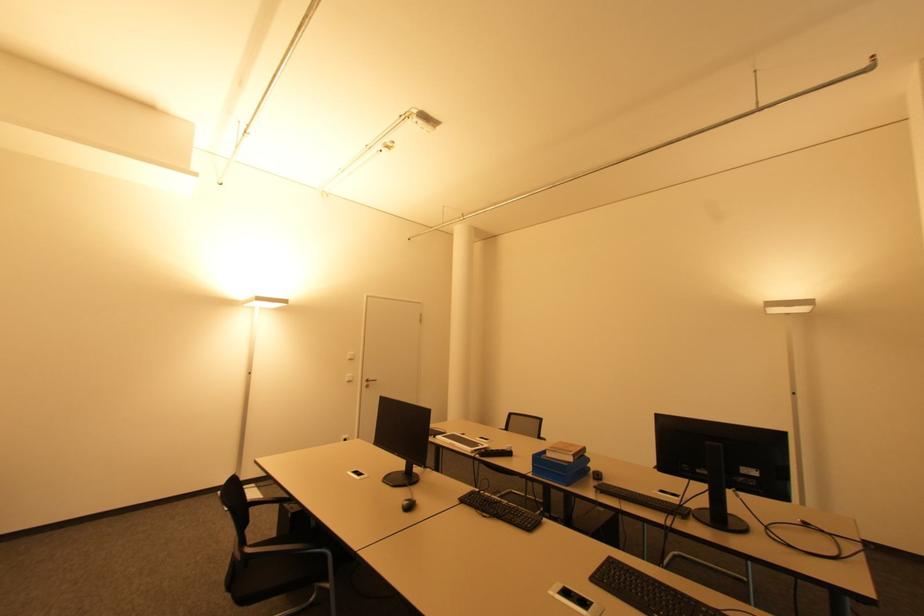
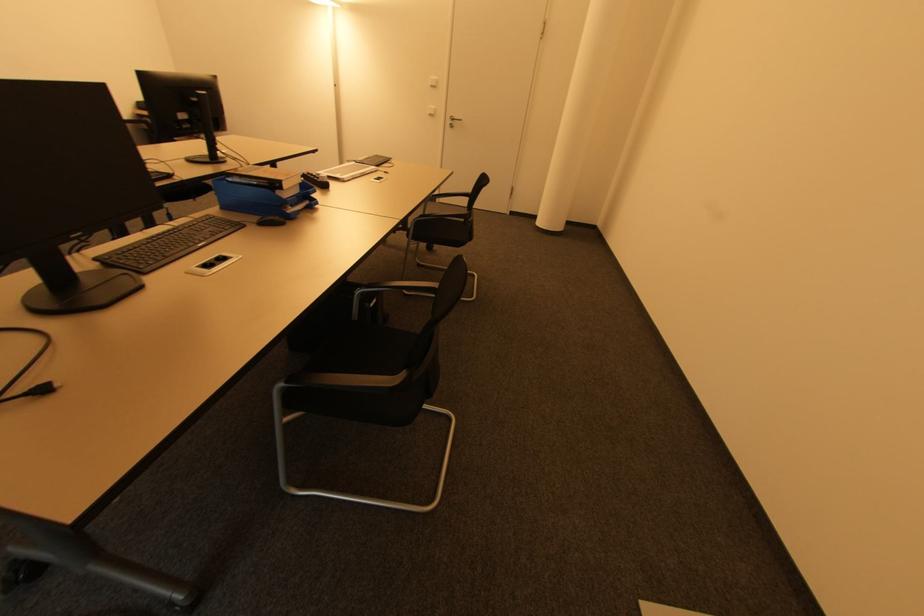
In the second image, find the point that corresponds to [369,387] in the first image.

(454, 127)